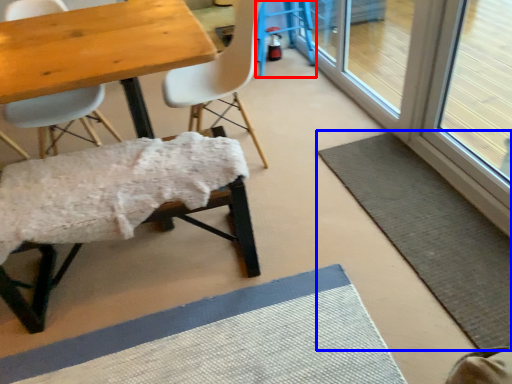
Question: Which object is closer to the camera taking this photo, bar stool (highlighted by a red box) or bath mat (highlighted by a blue box)?

Choices:
 (A) bar stool
 (B) bath mat

Answer: (B)